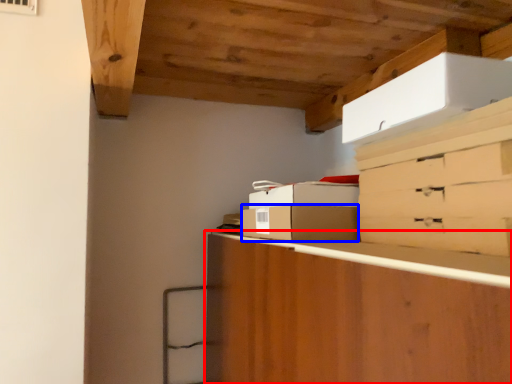
Question: Which object appears farthest to the camera in this image, cabinetry (highlighted by a red box) or cardboard box (highlighted by a blue box)?

Choices:
 (A) cabinetry
 (B) cardboard box

Answer: (B)